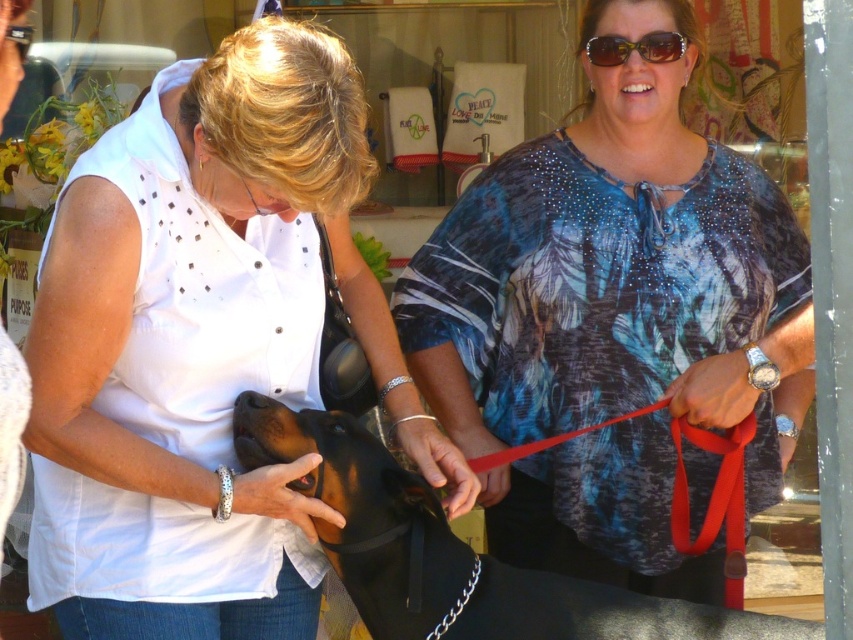
Which of these two, black leather dog at center or red fabric leash at center right, stands taller?

black leather dog at center is taller.

Identify the location of black leather dog at center. point(451,552).

I want to click on black leather dog at center, so click(451, 552).

Is white dotted shirt at center above blue tie-dye blouse at center?

No.

Based on the photo, measure the distance between white dotted shirt at center and camera.

2.13 meters

Identify the location of white dotted shirt at center. This screenshot has width=853, height=640. (202, 346).

Is blue tie-dye blouse at center to the right of red fabric leash at center right from the viewer's perspective?

In fact, blue tie-dye blouse at center is to the left of red fabric leash at center right.

The height and width of the screenshot is (640, 853). I want to click on blue tie-dye blouse at center, so click(x=611, y=317).

You are a GUI agent. You are given a task and a screenshot of the screen. Output one action in this format:
    pyautogui.click(x=<x>, y=<y>)
    Task: Click on the blue tie-dye blouse at center
    Image resolution: width=853 pixels, height=640 pixels.
    Given the screenshot: What is the action you would take?
    pyautogui.click(x=611, y=317)